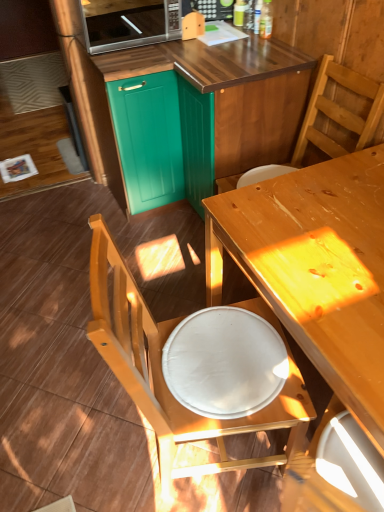
Question: Is wooden chair at lower left, the second chair in the top-to-bottom sequence, positioned far away from white glossy plate at lower center?

Choices:
 (A) yes
 (B) no

Answer: (B)

Question: Does wooden chair at lower left, the second chair in the top-to-bottom sequence, have a lesser width compared to white glossy plate at lower center?

Choices:
 (A) no
 (B) yes

Answer: (A)

Question: Is wooden chair at lower left, the second chair in the top-to-bottom sequence, placed right next to white glossy plate at lower center?

Choices:
 (A) yes
 (B) no

Answer: (B)

Question: Is wooden chair at lower left, the first chair in the bottom-to-top sequence, wider than white glossy plate at lower center?

Choices:
 (A) yes
 (B) no

Answer: (A)

Question: From a real-world perspective, is wooden chair at lower left, the second chair in the top-to-bottom sequence, over white glossy plate at lower center?

Choices:
 (A) yes
 (B) no

Answer: (B)

Question: Is wooden chair at lower left, the first chair in the bottom-to-top sequence, positioned with its back to white glossy plate at lower center?

Choices:
 (A) no
 (B) yes

Answer: (B)

Question: From the image's perspective, is satin silver microwave at upper center beneath wooden chair at lower left, the second chair in the top-to-bottom sequence?

Choices:
 (A) yes
 (B) no

Answer: (B)

Question: From a real-world perspective, is satin silver microwave at upper center located beneath wooden chair at lower left, the second chair in the top-to-bottom sequence?

Choices:
 (A) yes
 (B) no

Answer: (B)

Question: Is satin silver microwave at upper center turned away from wooden chair at lower left, the second chair in the top-to-bottom sequence?

Choices:
 (A) yes
 (B) no

Answer: (B)

Question: Is satin silver microwave at upper center taller than wooden chair at lower left, the second chair in the top-to-bottom sequence?

Choices:
 (A) yes
 (B) no

Answer: (B)

Question: Would you say wooden chair at lower left, the first chair in the bottom-to-top sequence, is part of satin silver microwave at upper center's contents?

Choices:
 (A) yes
 (B) no

Answer: (B)

Question: From a real-world perspective, is satin silver microwave at upper center on top of wooden chair at lower left, the first chair in the bottom-to-top sequence?

Choices:
 (A) no
 (B) yes

Answer: (B)

Question: From the image's perspective, is teal wood cabinet at upper center, marked as the 1th cabinetry in a right-to-left arrangement, located above wooden table at center?

Choices:
 (A) yes
 (B) no

Answer: (A)